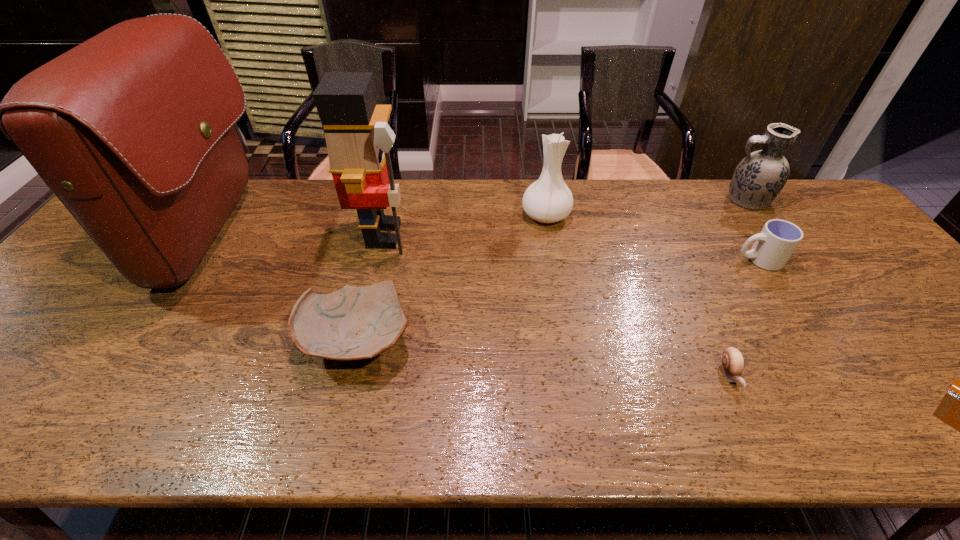
Locate an element on the screen. The width and height of the screenshot is (960, 540). vacant space that's between the left vase and the cup is located at coordinates (652, 238).

Image resolution: width=960 pixels, height=540 pixels. Find the location of `object that is the seventh nearest to the seventh shortest object`. object that is the seventh nearest to the seventh shortest object is located at coordinates tap(959, 409).

Identify which object is the closest to the right vase. Please provide its 2D coordinates. Your answer should be formatted as a tuple, i.e. [(x, y)], where the tuple contains the x and y coordinates of a point satisfying the conditions above.

[(774, 245)]

Where is `free space that satisfies the following two spatial constraints: 1. with the handle on the side of the cup; 2. on the front-facing side of the fourth object from right to left`? This screenshot has height=540, width=960. free space that satisfies the following two spatial constraints: 1. with the handle on the side of the cup; 2. on the front-facing side of the fourth object from right to left is located at coordinates (830, 374).

At what (x,y) coordinates should I click in order to perform the action: click on vacant region that satisfies the following two spatial constraints: 1. on the open flap of the pottery; 2. on the right side of the leftmost object. Please return your answer as a coordinate pair (x, y). The width and height of the screenshot is (960, 540). Looking at the image, I should click on (145, 340).